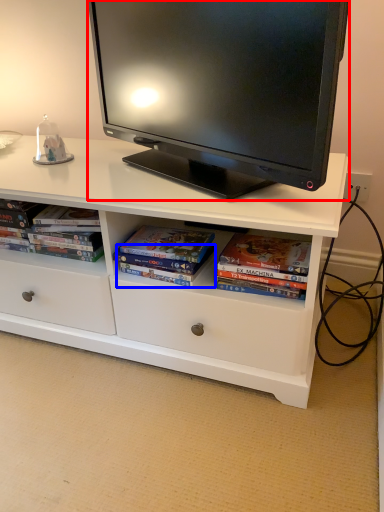
Question: Which object is closer to the camera taking this photo, television (highlighted by a red box) or paperback book (highlighted by a blue box)?

Choices:
 (A) television
 (B) paperback book

Answer: (A)